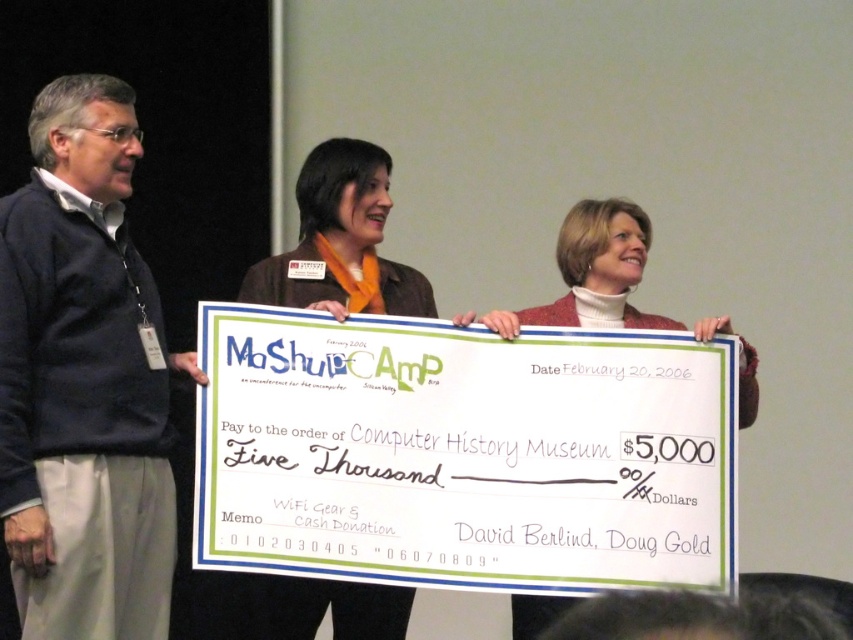
You are organizing a photo shoot and need to ensure that the brown leather jacket at center and the white turtleneck sweater at center are both visible in the frame. Given their sizes, which one requires more space in the composition?

The white turtleneck sweater at center requires more space in the composition because the brown leather jacket at center occupies less space than it.

Which individual is wearing the dark blue sweater at left?

The man on the left is wearing the dark blue sweater at left.